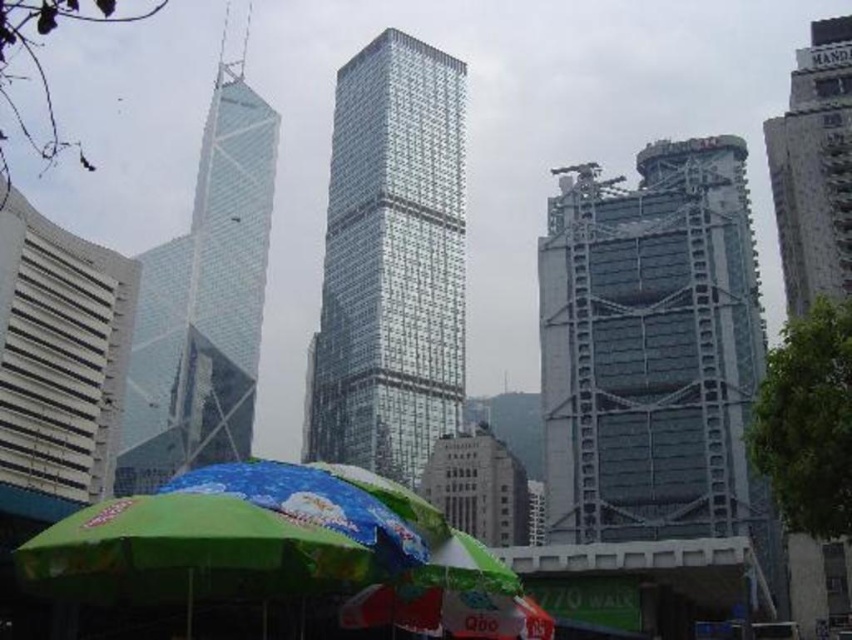
You are standing in the middle of the city square looking at the skyscrapers. There are two points marked in the image, point 1 at coordinates point (203, 381) and point 2 at coordinates point (832, 180). Which point is closer to you?

Point (203, 381) is closer to you because it is further to the viewer than point (832, 180).

You are an architect planning to install a large banner between the metallic scaffolding at right and the reflective glass skyscraper at center. Based on the scene, which structure has a wider base to ensure the banner can be securely anchored?

The metallic scaffolding at right has a wider base than the reflective glass skyscraper at center, so the banner should be anchored to the metallic scaffolding at right for stability.